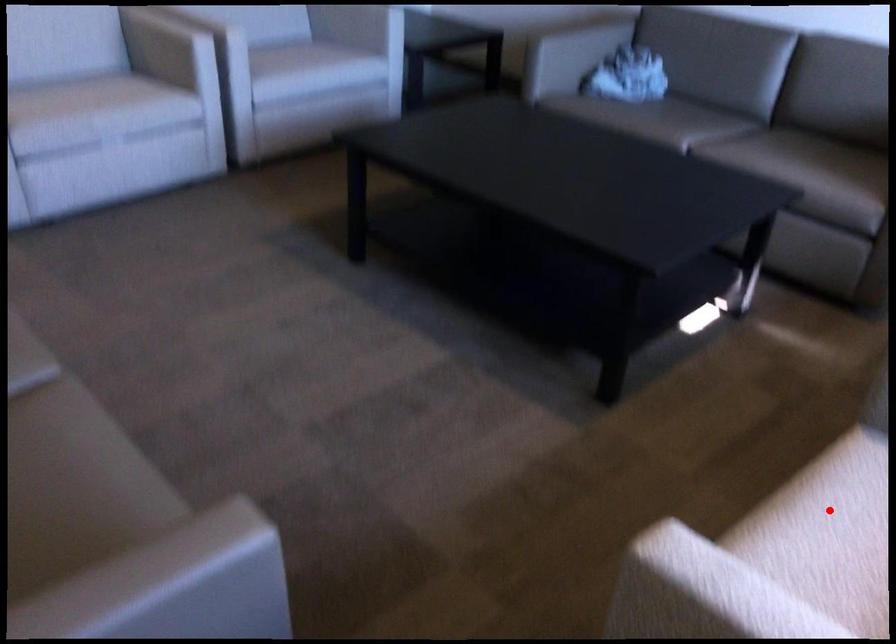
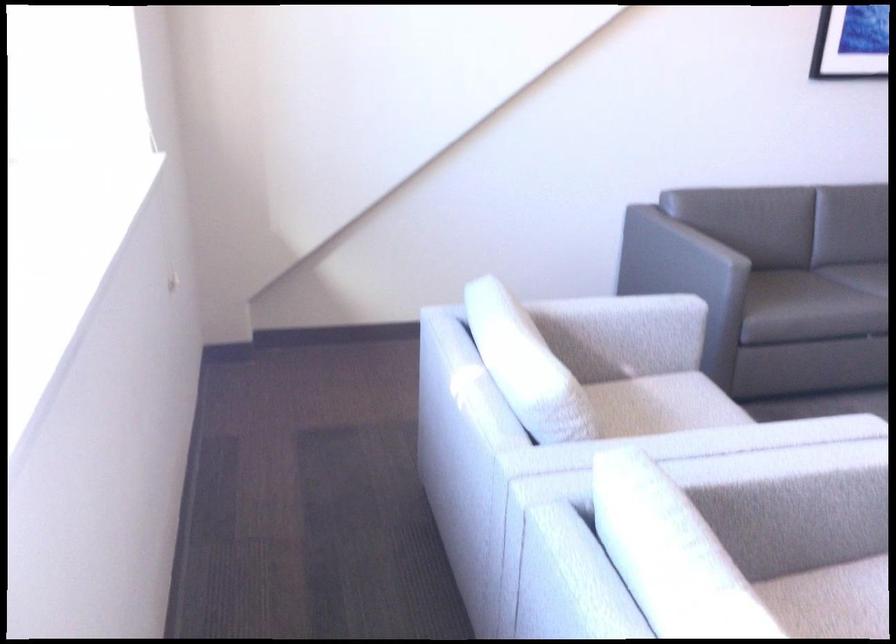
Question: I am providing you with two images of the same scene from different viewpoints. A red point is marked on the first image. Can you still see the location of the red point in image 2?

Choices:
 (A) Yes
 (B) No

Answer: (B)